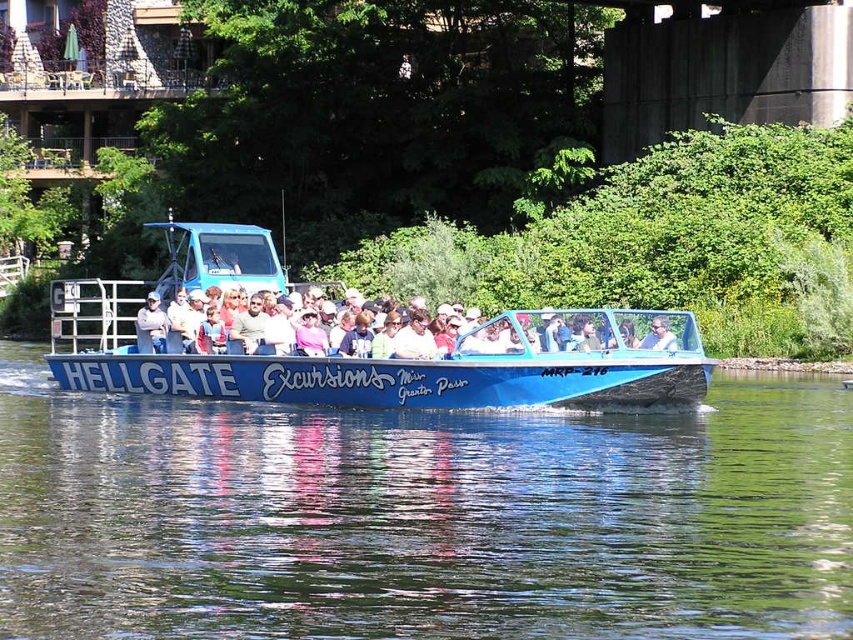
You are a photographer planning to take a photo of the blue glossy water at center and the blue plastic boat at center. Which object will occupy more area in your photo?

The blue plastic boat at center occupies more area in the photo than the blue glossy water at center because the blue glossy water at center occupies less space than blue plastic boat at center.